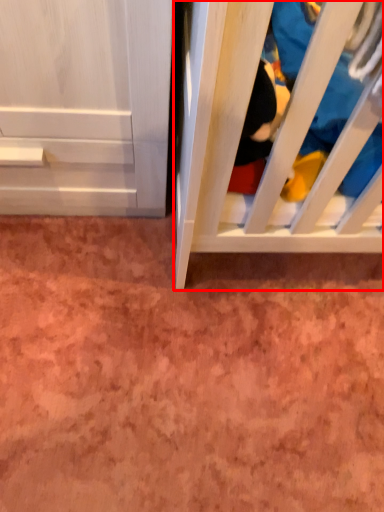
Question: Where is furniture (annotated by the red box) located in relation to clothing in the image?

Choices:
 (A) left
 (B) right

Answer: (A)